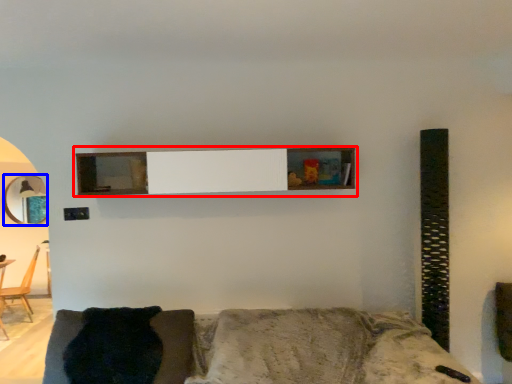
Question: Which of the following is the farthest to the observer, shelf (highlighted by a red box) or mirror (highlighted by a blue box)?

Choices:
 (A) shelf
 (B) mirror

Answer: (B)